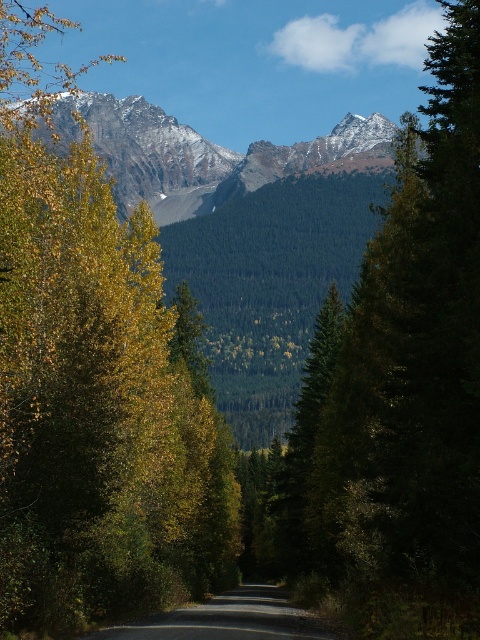
Question: Which point is farther to the camera?

Choices:
 (A) green matte tree at center
 (B) asphalt road at center
 (C) snowy rocky mountain range at upper center
 (D) yellow-green foliage at left

Answer: (C)

Question: Is green matte tree at center positioned at the back of asphalt road at center?

Choices:
 (A) yes
 (B) no

Answer: (B)

Question: Is snowy rocky mountain range at upper center positioned before asphalt road at center?

Choices:
 (A) no
 (B) yes

Answer: (A)

Question: Among these points, which one is farthest from the camera?

Choices:
 (A) (147, 451)
 (B) (200, 609)

Answer: (A)

Question: Is yellow-green foliage at left wider than asphalt road at center?

Choices:
 (A) no
 (B) yes

Answer: (B)

Question: Among these points, which one is nearest to the camera?

Choices:
 (A) (181, 188)
 (B) (465, 268)
 (C) (38, 12)

Answer: (B)